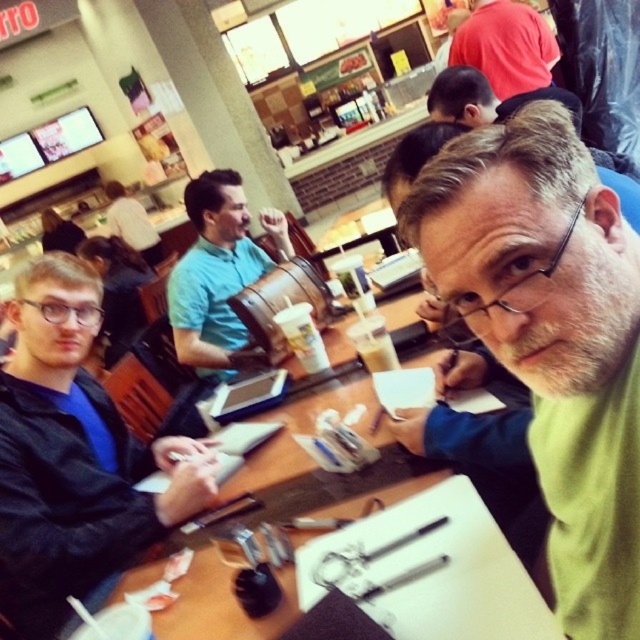
The width and height of the screenshot is (640, 640). Identify the location of green matte shirt at center. (552, 333).

Can you confirm if green matte shirt at center is positioned to the right of smooth brown leather jacket at upper center?

Incorrect, green matte shirt at center is not on the right side of smooth brown leather jacket at upper center.

Where is `green matte shirt at center`? This screenshot has height=640, width=640. green matte shirt at center is located at coordinates (552, 333).

Who is more distant from viewer, (124, 515) or (509, 64)?

The point (509, 64) is behind.

What do you see at coordinates (74, 458) in the screenshot? I see `black matte jacket at left` at bounding box center [74, 458].

Find the location of a particular element. Image resolution: width=640 pixels, height=640 pixels. black matte jacket at left is located at coordinates (74, 458).

Can you confirm if matte red shirt at upper center is shorter than smooth brown leather jacket at upper center?

No, matte red shirt at upper center is not shorter than smooth brown leather jacket at upper center.

From the picture: Does matte red shirt at upper center have a greater width compared to smooth brown leather jacket at upper center?

Indeed, matte red shirt at upper center has a greater width compared to smooth brown leather jacket at upper center.

Between point (522, 38) and point (468, 115), which one is positioned in front?

Point (468, 115) is more forward.

At what (x,y) coordinates should I click in order to perform the action: click on matte red shirt at upper center. Please return your answer as a coordinate pair (x, y). The image size is (640, 640). Looking at the image, I should click on (506, 45).